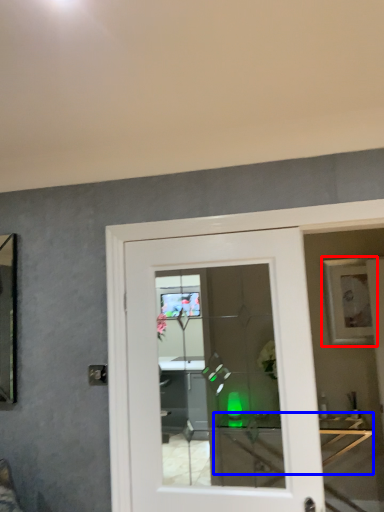
Question: Which object is further to the camera taking this photo, picture frame (highlighted by a red box) or table (highlighted by a blue box)?

Choices:
 (A) picture frame
 (B) table

Answer: (A)